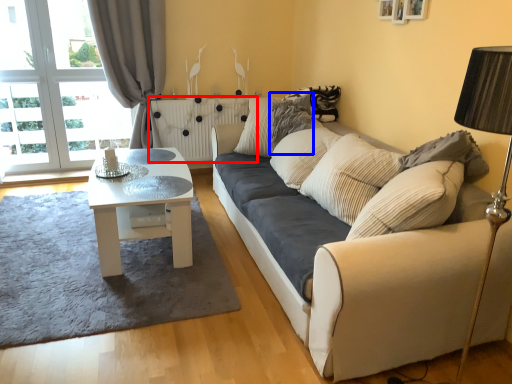
Question: Among these objects, which one is nearest to the camera, radiator (highlighted by a red box) or pillow (highlighted by a blue box)?

Choices:
 (A) radiator
 (B) pillow

Answer: (B)